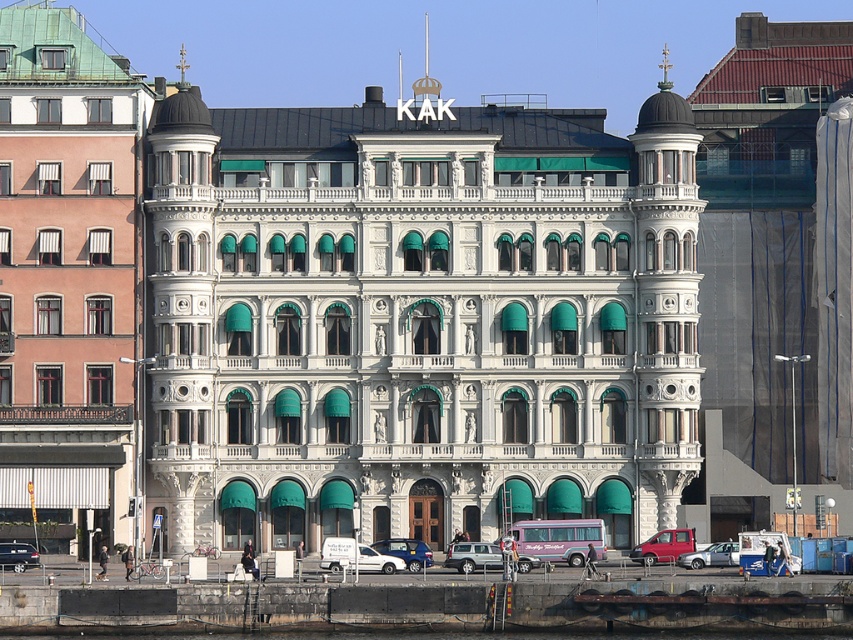
Can you confirm if metallic red van at lower right is shorter than metallic silver car at lower left?

Incorrect, metallic red van at lower right's height does not fall short of metallic silver car at lower left's.

Does metallic red van at lower right lie in front of metallic silver car at lower left?

No, metallic red van at lower right is behind metallic silver car at lower left.

At what (x,y) coordinates should I click in order to perform the action: click on metallic red van at lower right. Please return your answer as a coordinate pair (x, y). The image size is (853, 640). Looking at the image, I should click on (664, 545).

Is point (379, 564) positioned after point (422, 552)?

No.

Is the position of white matte van at center more distant than that of white matte van at lower center?

No.

Does point (341, 561) come in front of point (398, 556)?

That is True.

I want to click on white matte van at center, so click(x=357, y=556).

Can you confirm if silver metallic car at lower center is positioned to the right of white matte van at lower center?

Indeed, silver metallic car at lower center is positioned on the right side of white matte van at lower center.

Is silver metallic car at lower center in front of white matte van at lower center?

That is True.

Describe the element at coordinates (473, 556) in the screenshot. I see `silver metallic car at lower center` at that location.

Find the location of a particular element. The image size is (853, 640). silver metallic car at lower center is located at coordinates (473, 556).